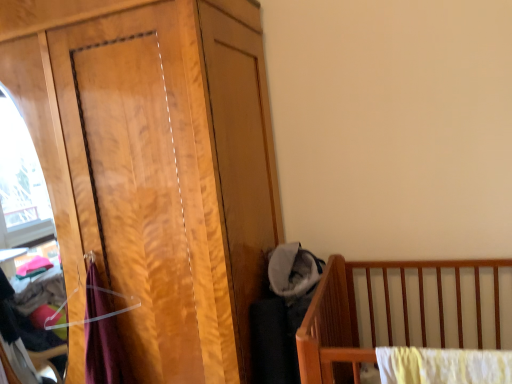
Question: From the image's perspective, is soft gray fabric at center located above or below wooden wardrobe at left?

Choices:
 (A) above
 (B) below

Answer: (B)

Question: Looking at their shapes, would you say soft gray fabric at center is wider or thinner than wooden wardrobe at left?

Choices:
 (A) thin
 (B) wide

Answer: (A)

Question: Would you say soft gray fabric at center is to the left or to the right of wooden wardrobe at left in the picture?

Choices:
 (A) left
 (B) right

Answer: (B)

Question: Considering the positions of wooden wardrobe at left and soft gray fabric at center in the image, is wooden wardrobe at left wider or thinner than soft gray fabric at center?

Choices:
 (A) wide
 (B) thin

Answer: (A)

Question: From a real-world perspective, is wooden wardrobe at left above or below soft gray fabric at center?

Choices:
 (A) above
 (B) below

Answer: (A)

Question: Is wooden wardrobe at left in front of or behind soft gray fabric at center in the image?

Choices:
 (A) behind
 (B) front

Answer: (B)

Question: Considering the positions of wooden wardrobe at left and soft gray fabric at center in the image, is wooden wardrobe at left taller or shorter than soft gray fabric at center?

Choices:
 (A) short
 (B) tall

Answer: (B)